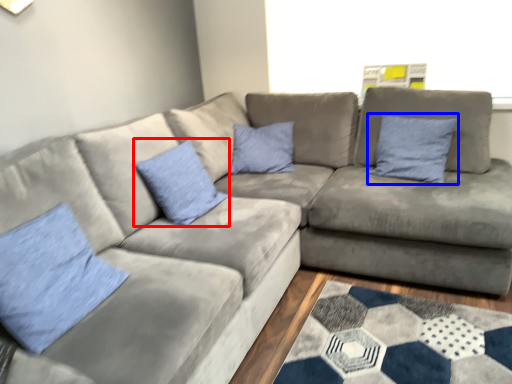
Question: Which object appears closest to the camera in this image, pillow (highlighted by a red box) or pillow (highlighted by a blue box)?

Choices:
 (A) pillow
 (B) pillow

Answer: (A)